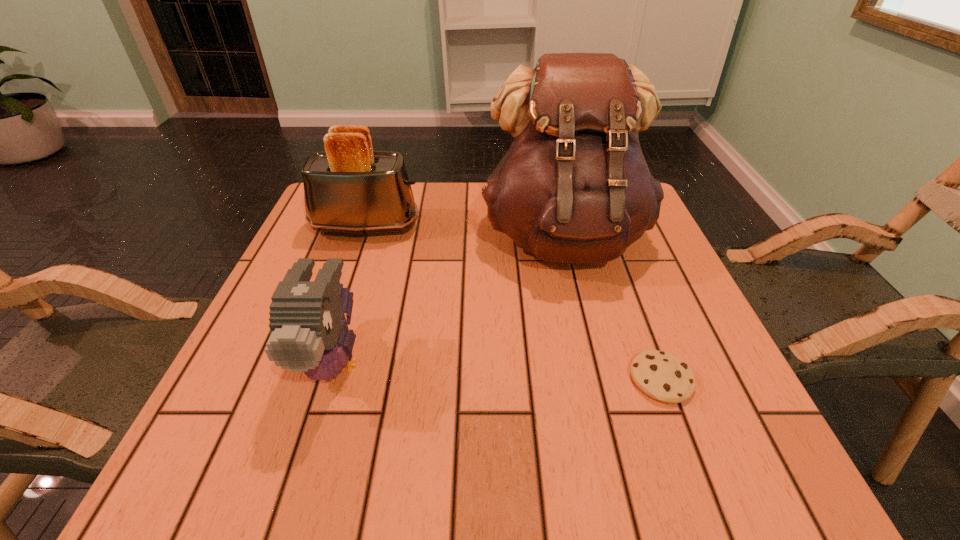
Where is `the tallest object`? This screenshot has width=960, height=540. the tallest object is located at coordinates (574, 187).

At what (x,y) coordinates should I click in order to perform the action: click on the third shortest object. Please return your answer as a coordinate pair (x, y). Looking at the image, I should click on tap(349, 188).

Where is `the third tallest object`? the third tallest object is located at coordinates (309, 333).

What are the coordinates of `the shortest object` in the screenshot? It's located at (663, 376).

Locate an element on the screen. The width and height of the screenshot is (960, 540). vacant space located 0.140m at the front of the tallest object with buckles is located at coordinates (588, 337).

Locate an element on the screen. The height and width of the screenshot is (540, 960). vacant space situated 0.090m on the side of the second tallest object with the control lever is located at coordinates (457, 226).

I want to click on free location located at the beak of the bird, so click(x=296, y=485).

I want to click on vacant space located on the back of the shortest object, so click(x=606, y=230).

You are a GUI agent. You are given a task and a screenshot of the screen. Output one action in this format:
    pyautogui.click(x=<x>, y=<y>)
    Task: Click on the satchel present at the far edge
    This screenshot has width=960, height=540.
    Given the screenshot: What is the action you would take?
    pyautogui.click(x=574, y=187)

Image resolution: width=960 pixels, height=540 pixels. What are the coordinates of `toaster at the far edge` in the screenshot? It's located at (349, 188).